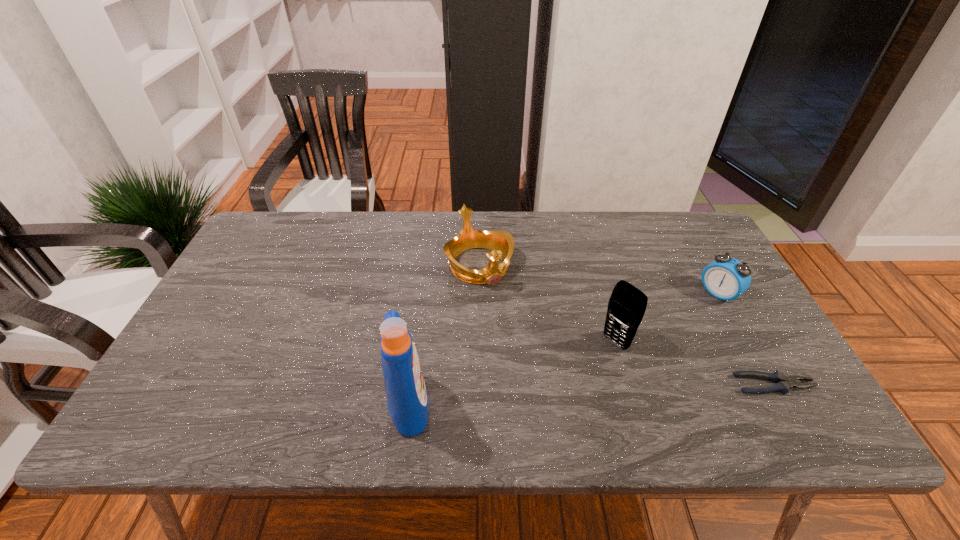
The width and height of the screenshot is (960, 540). I want to click on free spot between the detergent and the pliers, so (x=591, y=394).

Locate an element on the screen. free space that is in between the leftmost object and the fourth object from right to left is located at coordinates (444, 335).

At what (x,y) coordinates should I click in order to perform the action: click on unoccupied area between the third object from right to left and the pliers. Please return your answer as a coordinate pair (x, y). Looking at the image, I should click on (695, 363).

Find the location of a particular element. The image size is (960, 540). free point between the alarm clock and the tallest object is located at coordinates (564, 348).

Locate an element on the screen. This screenshot has height=540, width=960. empty location between the tiara and the detergent is located at coordinates (444, 335).

You are a GUI agent. You are given a task and a screenshot of the screen. Output one action in this format:
    pyautogui.click(x=<x>, y=<y>)
    Task: Click on the free point between the alarm clock and the leftmost object
    This screenshot has height=540, width=960.
    Given the screenshot: What is the action you would take?
    coord(564,348)

Locate an element on the screen. The height and width of the screenshot is (540, 960). free space between the shortest object and the alarm clock is located at coordinates (746, 339).

At what (x,y) coordinates should I click in order to perform the action: click on free space between the alarm clock and the shortest object. Please return your answer as a coordinate pair (x, y). This screenshot has width=960, height=540. Looking at the image, I should click on (746, 339).

Choose which object is the nearest neighbor to the tallest object. Please provide its 2D coordinates. Your answer should be formatted as a tuple, i.e. [(x, y)], where the tuple contains the x and y coordinates of a point satisfying the conditions above.

[(501, 243)]

Image resolution: width=960 pixels, height=540 pixels. Identify the location of object that is the nearest to the cellular telephone. coord(783,383).